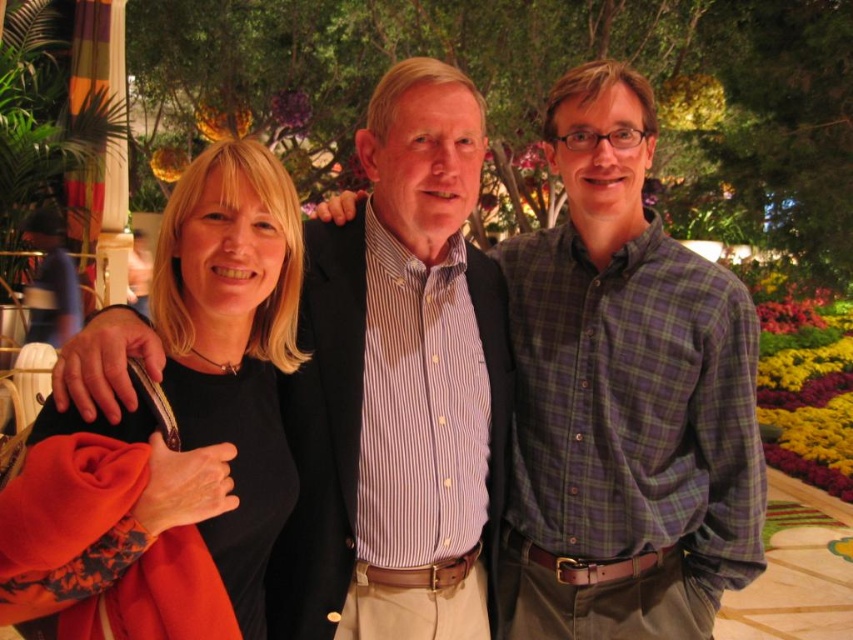
Question: Which of the following is the farthest from the observer?

Choices:
 (A) purple flannel shirt at center
 (B) black matte shirt at left

Answer: (A)

Question: Which of the following is the closest to the observer?

Choices:
 (A) purple flannel shirt at center
 (B) black matte shirt at left

Answer: (B)

Question: Is purple flannel shirt at center in front of black matte shirt at left?

Choices:
 (A) no
 (B) yes

Answer: (A)

Question: In this image, where is purple flannel shirt at center located relative to black matte shirt at left?

Choices:
 (A) left
 (B) right

Answer: (B)

Question: Does purple flannel shirt at center appear over black matte shirt at left?

Choices:
 (A) no
 (B) yes

Answer: (B)